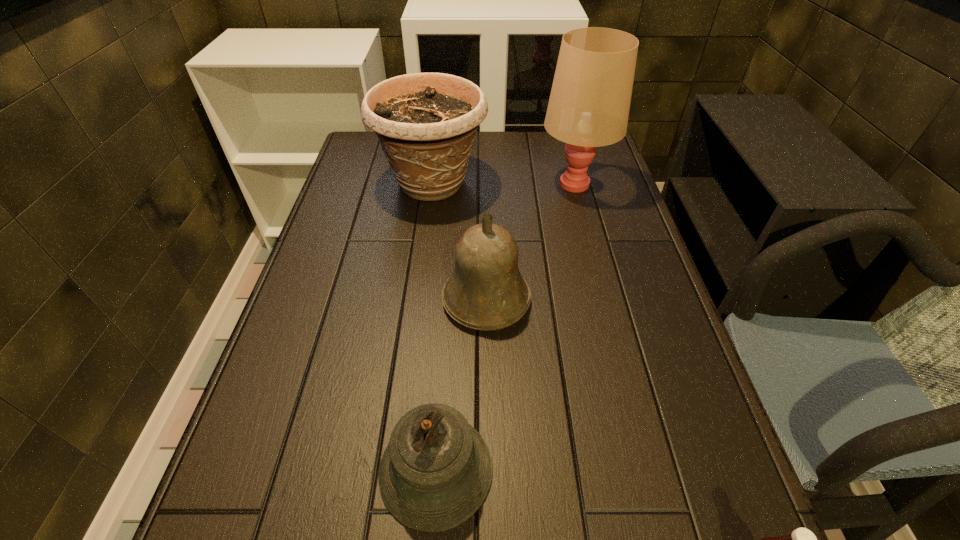
Find the location of a particular element. This screenshot has height=540, width=960. lampshade present at the far edge is located at coordinates 589,104.

Where is `flowerpot situated at the far edge`? flowerpot situated at the far edge is located at coordinates (426, 122).

At what (x,y) coordinates should I click in order to perform the action: click on object that is positioned at the left edge. Please return your answer as a coordinate pair (x, y). This screenshot has width=960, height=540. Looking at the image, I should click on (426, 122).

You are a GUI agent. You are given a task and a screenshot of the screen. Output one action in this format:
    pyautogui.click(x=<x>, y=<y>)
    Task: Click on the object positioned at the right edge
    
    Given the screenshot: What is the action you would take?
    pyautogui.click(x=589, y=104)

Identify the location of object present at the far left corner. The image size is (960, 540). (426, 122).

This screenshot has height=540, width=960. Find the location of `object positioned at the far right corner`. object positioned at the far right corner is located at coordinates (589, 104).

Find the location of a particular element. The width and height of the screenshot is (960, 540). vacant space at the far edge is located at coordinates (508, 147).

Locate an element on the screen. vacant space at the left edge of the desktop is located at coordinates (312, 259).

In order to click on vacant space at the right edge in this screenshot , I will do `click(629, 242)`.

You are a GUI agent. You are given a task and a screenshot of the screen. Output one action in this format:
    pyautogui.click(x=<x>, y=<y>)
    Task: Click on the vacant area at the far right corner
    The height and width of the screenshot is (540, 960).
    Given the screenshot: What is the action you would take?
    pyautogui.click(x=606, y=162)